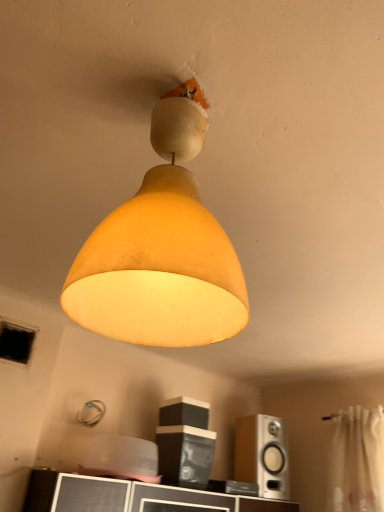
What is the approximate height of matte black speaker at center, the 2th speaker when ordered from bottom to top?

It is 6.12 inches.

The width and height of the screenshot is (384, 512). What are the coordinates of `white sheer curtain at right` in the screenshot? It's located at (357, 461).

Consider the image. Is matte yellow lampshade at center to the left or to the right of matte black speaker at center, the 1th speaker when ordered from left to right, in the image?

Based on their positions, matte yellow lampshade at center is located to the left of matte black speaker at center, the 1th speaker when ordered from left to right.

From a real-world perspective, is matte yellow lampshade at center located beneath matte black speaker at center, the 1th speaker when ordered from left to right?

Actually, matte yellow lampshade at center is physically above matte black speaker at center, the 1th speaker when ordered from left to right, in the real world.

How much distance is there between matte yellow lampshade at center and matte black speaker at center, the 2th speaker when ordered from bottom to top?

The distance of matte yellow lampshade at center from matte black speaker at center, the 2th speaker when ordered from bottom to top, is 1.45 meters.

Relative to matte black speaker at center, the 2th speaker when ordered from bottom to top, is matte yellow lampshade at center in front or behind?

In the image, matte yellow lampshade at center appears in front of matte black speaker at center, the 2th speaker when ordered from bottom to top.

Identify the location of lamp that is in front of the white sheer curtain at right. Image resolution: width=384 pixels, height=512 pixels. (162, 250).

Does matte yellow lampshade at center touch white sheer curtain at right?

No, matte yellow lampshade at center is not next to white sheer curtain at right.

Could you tell me if matte yellow lampshade at center is facing white sheer curtain at right?

No, matte yellow lampshade at center is not aimed at white sheer curtain at right.

Looking at the image, does silver metallic speaker at lower right, which appears as the 1th speaker when ordered from the bottom, seem bigger or smaller compared to white sheer curtain at right?

Clearly, silver metallic speaker at lower right, which appears as the 1th speaker when ordered from the bottom, is smaller in size than white sheer curtain at right.

Looking at this image, is silver metallic speaker at lower right, which appears as the 1th speaker when ordered from the bottom, far away from white sheer curtain at right?

That's not correct — silver metallic speaker at lower right, which appears as the 1th speaker when ordered from the bottom, is a little close to white sheer curtain at right.

How different are the orientations of silver metallic speaker at lower right, which appears as the 1th speaker when ordered from the bottom, and white sheer curtain at right in degrees?

The facing directions of silver metallic speaker at lower right, which appears as the 1th speaker when ordered from the bottom, and white sheer curtain at right are 75.2 degrees apart.

Find the location of a particular element. lamp on the left of silver metallic speaker at lower right, which is the second speaker in left-to-right order is located at coordinates (162, 250).

Is matte yellow lampshade at center far from silver metallic speaker at lower right, acting as the 1th speaker starting from the right?

Indeed, matte yellow lampshade at center is not near silver metallic speaker at lower right, acting as the 1th speaker starting from the right.

Considering the sizes of matte yellow lampshade at center and silver metallic speaker at lower right, which appears as the 1th speaker when ordered from the bottom, in the image, is matte yellow lampshade at center taller or shorter than silver metallic speaker at lower right, which appears as the 1th speaker when ordered from the bottom,?

Clearly, matte yellow lampshade at center is taller compared to silver metallic speaker at lower right, which appears as the 1th speaker when ordered from the bottom.

Can you tell me how much matte yellow lampshade at center and silver metallic speaker at lower right, which is the second speaker in top-to-bottom order, differ in facing direction?

14.8 degrees.

Considering their positions, is silver metallic speaker at lower right, which appears as the 1th speaker when ordered from the bottom, located in front of or behind matte yellow lampshade at center?

In the image, silver metallic speaker at lower right, which appears as the 1th speaker when ordered from the bottom, appears behind matte yellow lampshade at center.

Are silver metallic speaker at lower right, which is the second speaker in left-to-right order, and matte yellow lampshade at center making contact?

No, silver metallic speaker at lower right, which is the second speaker in left-to-right order, is not making contact with matte yellow lampshade at center.

Consider the image. Between silver metallic speaker at lower right, acting as the 1th speaker starting from the right, and matte yellow lampshade at center, which one has more height?

With more height is matte yellow lampshade at center.

How different are the orientations of silver metallic speaker at lower right, which appears as the 1th speaker when ordered from the bottom, and matte black speaker at center, the 2th speaker when ordered from bottom to top, in degrees?

11.7 degrees separate the facing orientations of silver metallic speaker at lower right, which appears as the 1th speaker when ordered from the bottom, and matte black speaker at center, the 2th speaker when ordered from bottom to top.

From a real-world perspective, is silver metallic speaker at lower right, which is the second speaker in top-to-bottom order, on matte black speaker at center, the 1th speaker when ordered from left to right?

No.

This screenshot has height=512, width=384. I want to click on speaker above the silver metallic speaker at lower right, which is the second speaker in top-to-bottom order (from a real-world perspective), so click(184, 412).

Measure the distance between silver metallic speaker at lower right, which is the second speaker in top-to-bottom order, and matte black speaker at center, the first speaker positioned from the top.

18.25 inches.

Is white sheer curtain at right next to matte yellow lampshade at center and touching it?

No, white sheer curtain at right is not beside matte yellow lampshade at center.

Considering the sizes of objects white sheer curtain at right and matte yellow lampshade at center in the image provided, who is wider, white sheer curtain at right or matte yellow lampshade at center?

matte yellow lampshade at center is wider.

Does white sheer curtain at right lie behind matte yellow lampshade at center?

Yes, it is behind matte yellow lampshade at center.

Does point (351, 438) lie in front of point (131, 304)?

No, it is not.

Find the location of a particular element. lamp that appears above the matte black speaker at center, the 1th speaker when ordered from left to right (from the image's perspective) is located at coordinates (162, 250).

Where is `curtain below the matte yellow lampshade at center (from the image's perspective)`? This screenshot has width=384, height=512. curtain below the matte yellow lampshade at center (from the image's perspective) is located at coordinates (357, 461).

Considering their positions, is silver metallic speaker at lower right, which appears as the 1th speaker when ordered from the bottom, positioned further to matte black speaker at center, the 2th speaker when ordered from bottom to top, than matte yellow lampshade at center?

matte yellow lampshade at center is positioned further to the anchor matte black speaker at center, the 2th speaker when ordered from bottom to top.

Estimate the real-world distances between objects in this image. Which object is further from white sheer curtain at right, matte yellow lampshade at center or silver metallic speaker at lower right, which is the second speaker in top-to-bottom order?

Based on the image, matte yellow lampshade at center appears to be further to white sheer curtain at right.

From the image, which object appears to be nearer to silver metallic speaker at lower right, which appears as the 1th speaker when ordered from the bottom, matte yellow lampshade at center or white sheer curtain at right?

Among the two, white sheer curtain at right is located nearer to silver metallic speaker at lower right, which appears as the 1th speaker when ordered from the bottom.

Estimate the real-world distances between objects in this image. Which object is further from matte yellow lampshade at center, white sheer curtain at right or matte black speaker at center, the first speaker positioned from the top?

Result: The object further to matte yellow lampshade at center is white sheer curtain at right.

Estimate the real-world distances between objects in this image. Which object is closer to matte yellow lampshade at center, matte black speaker at center, the 2th speaker when ordered from bottom to top, or silver metallic speaker at lower right, which is the second speaker in top-to-bottom order?

matte black speaker at center, the 2th speaker when ordered from bottom to top, is closer to matte yellow lampshade at center.

Which object lies further to the anchor point silver metallic speaker at lower right, which is the second speaker in top-to-bottom order, matte black speaker at center, the first speaker positioned from the top, or white sheer curtain at right?

matte black speaker at center, the first speaker positioned from the top.

Looking at the image, which one is located closer to white sheer curtain at right, matte black speaker at center, positioned as the 2th speaker in right-to-left order, or matte yellow lampshade at center?

matte black speaker at center, positioned as the 2th speaker in right-to-left order, is closer to white sheer curtain at right.

Based on their spatial positions, is matte black speaker at center, the first speaker positioned from the top, or matte yellow lampshade at center further from silver metallic speaker at lower right, which is the second speaker in top-to-bottom order?

Among the two, matte yellow lampshade at center is located further to silver metallic speaker at lower right, which is the second speaker in top-to-bottom order.

Locate an element on the screen. speaker between matte black speaker at center, positioned as the 2th speaker in right-to-left order, and white sheer curtain at right is located at coordinates (262, 455).

Find the location of a particular element. speaker between matte yellow lampshade at center and silver metallic speaker at lower right, which is the second speaker in left-to-right order, from front to back is located at coordinates (184, 412).

Find the location of a particular element. The image size is (384, 512). curtain positioned between matte yellow lampshade at center and silver metallic speaker at lower right, which is the second speaker in top-to-bottom order, from near to far is located at coordinates (357, 461).

Identify the location of curtain between matte yellow lampshade at center and matte black speaker at center, the 2th speaker when ordered from bottom to top, from front to back. Image resolution: width=384 pixels, height=512 pixels. (357, 461).